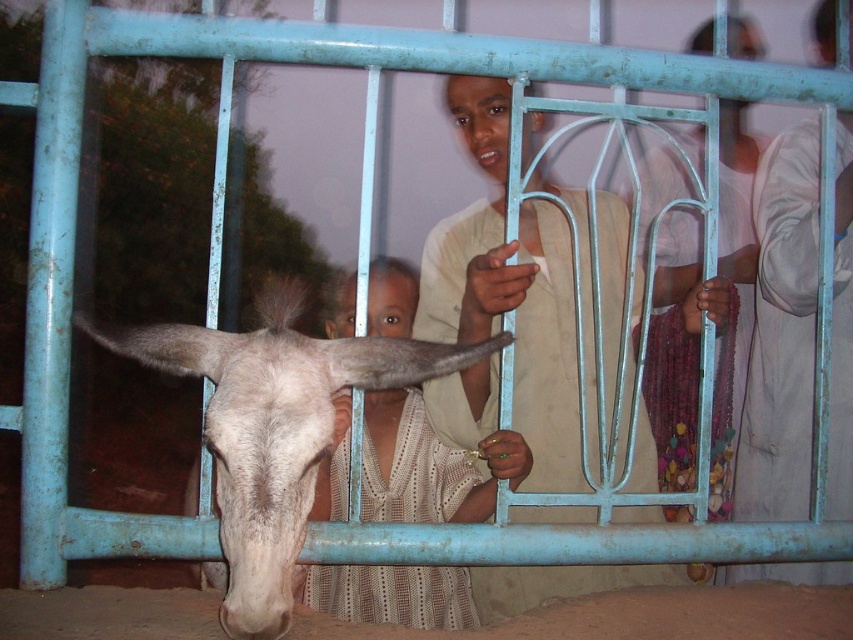
Question: Which of the following is the closest to the observer?

Choices:
 (A) [x=711, y=28]
 (B) [x=495, y=166]
 (C) [x=389, y=262]
 (D) [x=494, y=173]

Answer: (B)

Question: Is light beige lace dress at center to the right of light brown hair at center from the viewer's perspective?

Choices:
 (A) no
 (B) yes

Answer: (B)

Question: Which of the following is the farthest from the observer?

Choices:
 (A) (824, 52)
 (B) (160, 326)

Answer: (A)

Question: From the image, what is the correct spatial relationship of light beige fabric at center in relation to light brown hair at center?

Choices:
 (A) above
 (B) below

Answer: (B)

Question: Does light beige lace dress at center come behind smooth skin head at upper center?

Choices:
 (A) no
 (B) yes

Answer: (A)

Question: Which of these objects is positioned farthest from the light beige fabric at center?

Choices:
 (A) light beige lace dress at center
 (B) smooth skin head at upper center
 (C) white matte donkey head at center
 (D) white matte donkey at center

Answer: (B)